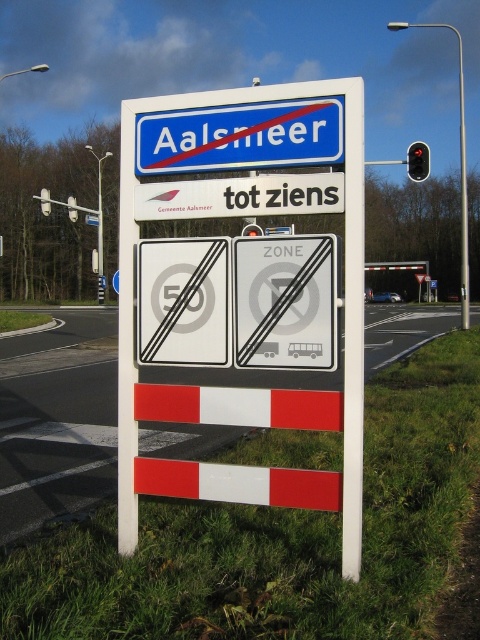
Question: Does white plastic sign at center have a larger size compared to white plastic speed limit sign at center?

Choices:
 (A) no
 (B) yes

Answer: (B)

Question: Estimate the real-world distances between objects in this image. Which object is farther from the blue plastic sign at upper center?

Choices:
 (A) white plastic speed limit sign at upper center
 (B) white plastic sign at center
 (C) red glass traffic light at upper right
 (D) white plastic signboard at upper center

Answer: (A)

Question: Can you confirm if green grass at lower center is thinner than white plastic speed limit sign at upper center?

Choices:
 (A) no
 (B) yes

Answer: (A)

Question: Is blue plastic sign at upper center wider than white plastic speed limit sign at upper center?

Choices:
 (A) no
 (B) yes

Answer: (A)

Question: Estimate the real-world distances between objects in this image. Which object is farther from the red glass traffic light at upper right?

Choices:
 (A) green grass at lower center
 (B) blue plastic sign at upper center

Answer: (B)

Question: Which point is farther from the camera taking this photo?

Choices:
 (A) (315, 177)
 (B) (300, 256)
 (C) (97, 225)

Answer: (C)